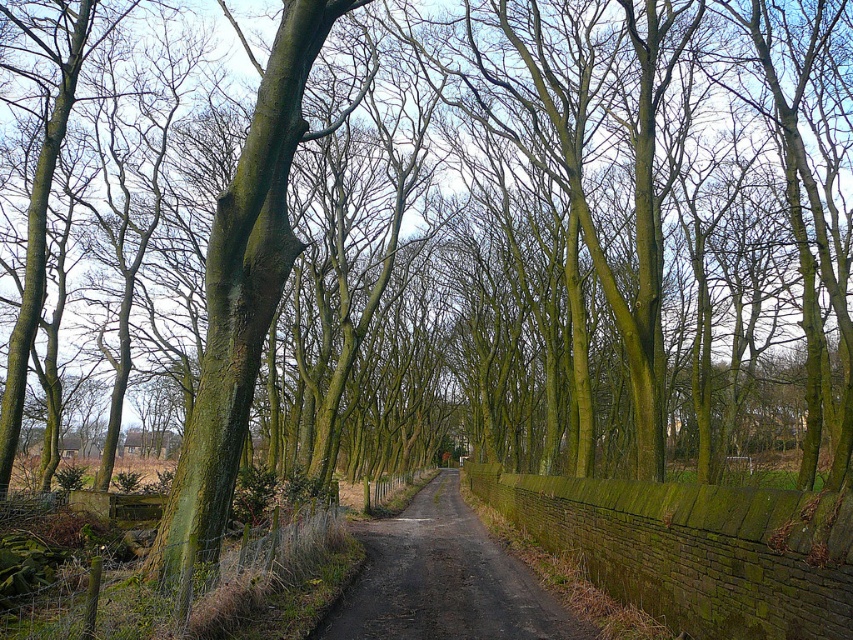
Question: Does green mossy wire at lower left appear on the left side of dark brown asphalt at center?

Choices:
 (A) yes
 (B) no

Answer: (A)

Question: Which point appears closest to the camera in this image?

Choices:
 (A) (184, 600)
 (B) (456, 577)

Answer: (A)

Question: Is green mossy wire at lower left thinner than dark brown asphalt at center?

Choices:
 (A) no
 (B) yes

Answer: (B)

Question: Which point appears farthest from the camera in this image?

Choices:
 (A) (334, 536)
 (B) (410, 593)

Answer: (A)

Question: Is green mossy wire at lower left to the right of dark brown asphalt at center from the viewer's perspective?

Choices:
 (A) yes
 (B) no

Answer: (B)

Question: Which of the following is the farthest from the observer?

Choices:
 (A) (338, 628)
 (B) (125, 596)

Answer: (A)